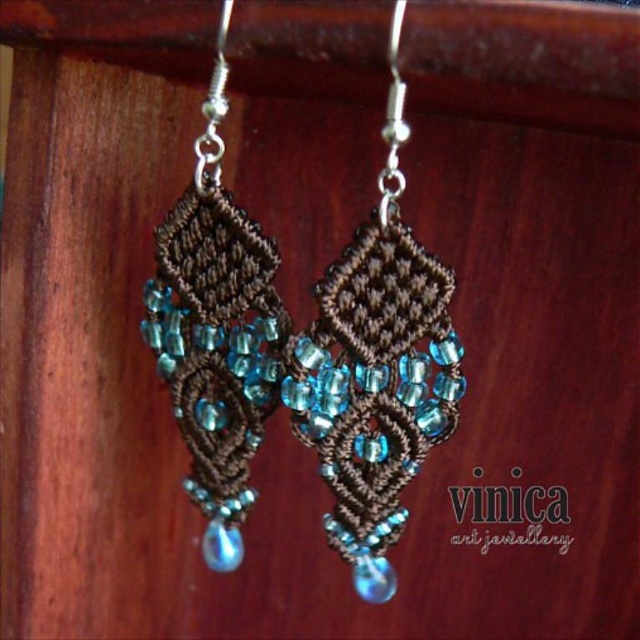
Question: Can you confirm if matte brown macrame earrings at center is positioned above matte brown macrame earrings at left?

Choices:
 (A) yes
 (B) no

Answer: (A)

Question: Which point is farther to the camera?

Choices:
 (A) (193, 282)
 (B) (378, 403)

Answer: (A)

Question: Considering the relative positions of matte brown macrame earrings at center and matte brown macrame earrings at left in the image provided, where is matte brown macrame earrings at center located with respect to matte brown macrame earrings at left?

Choices:
 (A) left
 (B) right

Answer: (B)

Question: Does matte brown macrame earrings at center appear on the right side of matte brown macrame earrings at left?

Choices:
 (A) yes
 (B) no

Answer: (A)